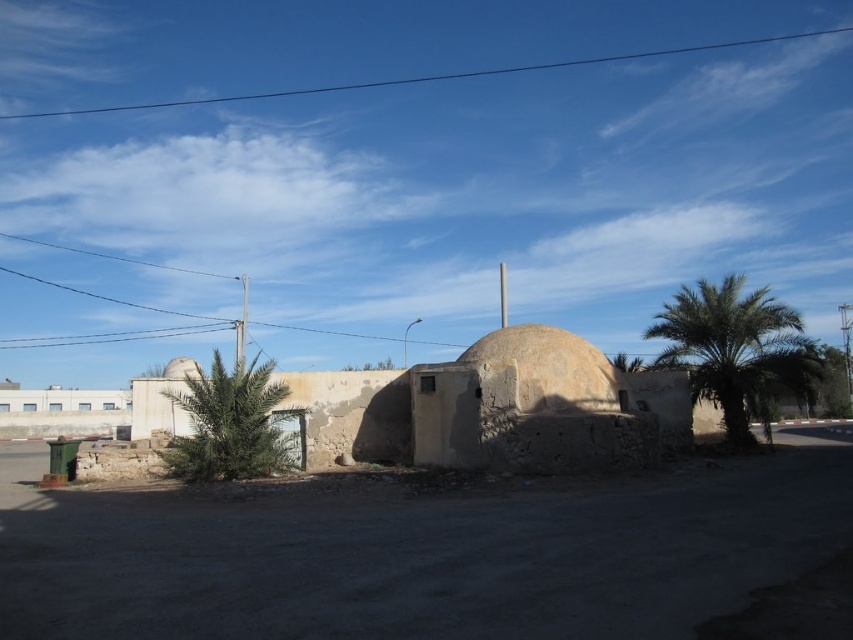
Question: Does green leafy palm tree at center appear on the left side of smooth beige dome at center?

Choices:
 (A) no
 (B) yes

Answer: (A)

Question: Which point appears farthest from the camera in this image?

Choices:
 (A) (x=590, y=371)
 (B) (x=720, y=381)

Answer: (B)

Question: Which object is the farthest from the gray stone dome at center?

Choices:
 (A) green leafy palm at right
 (B) smooth beige dome at center
 (C) green leafy palm tree at center

Answer: (B)

Question: Can you confirm if green leafy palm at right is wider than gray stone dome at center?

Choices:
 (A) yes
 (B) no

Answer: (A)

Question: Is green leafy palm tree at center thinner than smooth beige dome at center?

Choices:
 (A) yes
 (B) no

Answer: (A)

Question: Among these objects, which one is farthest from the camera?

Choices:
 (A) smooth beige dome at center
 (B) green leafy palm tree at center
 (C) gray stone dome at center

Answer: (A)